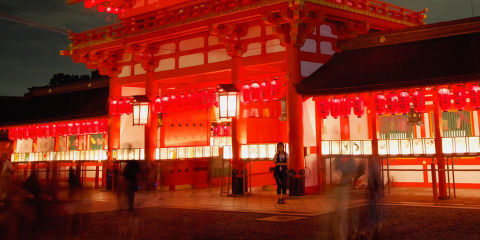
Where is `lamps`? lamps is located at coordinates (136, 115), (232, 108).